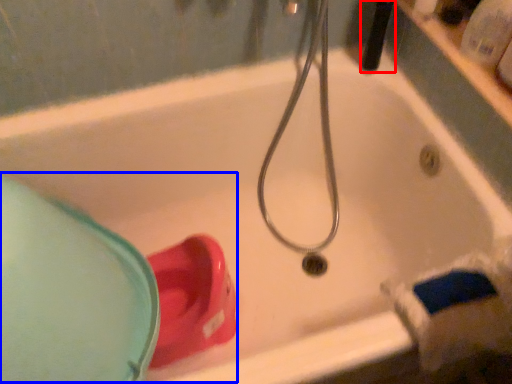
Question: Among these objects, which one is farthest to the camera, shower (highlighted by a red box) or sink (highlighted by a blue box)?

Choices:
 (A) shower
 (B) sink

Answer: (A)